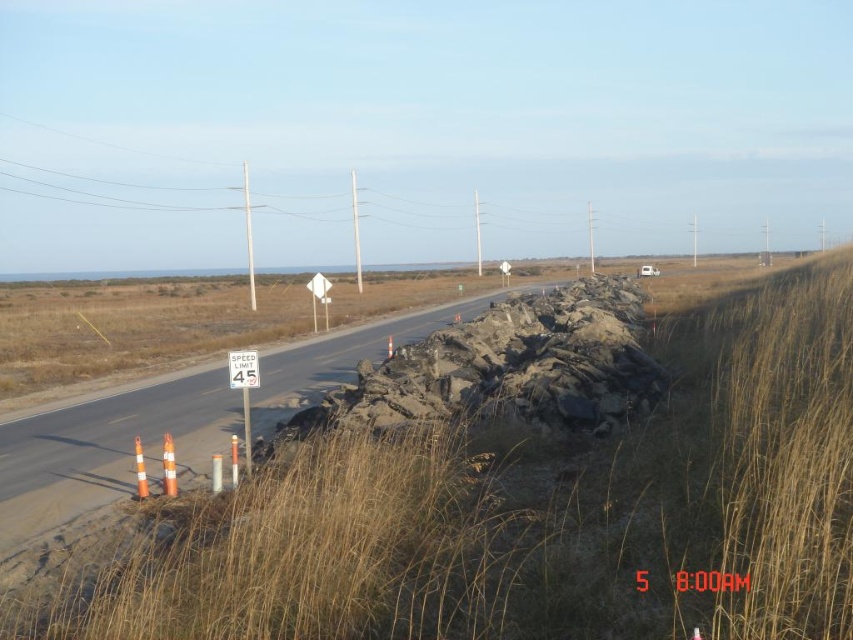
You are driving on a rural road at 8 AM and see the brown dry grass at center and the white plastic speed limit sign at center. Which object takes up more horizontal space in your view?

The brown dry grass at center takes up more horizontal space than the white plastic speed limit sign at center because its width is larger than the sign.

Based on the photo, you are driving along the road at 8 AM and see two points marked on the map. The first point is at coordinates point (740,605) and the second is at point (248,364). If you are facing the direction of the road, which point is closer to your current position?

Point (740,605) is in front of point (248,364), so if you are facing the direction of the road, the point (740,605) is closer to your current position.

Based on the photo, you are driving on a rural road at 8 AM and see the brown dry grass at center and the white plastic speed limit sign at center. According to the scene description, which object is located to the right of the other?

The brown dry grass at center is positioned on the right side of white plastic speed limit sign at center.